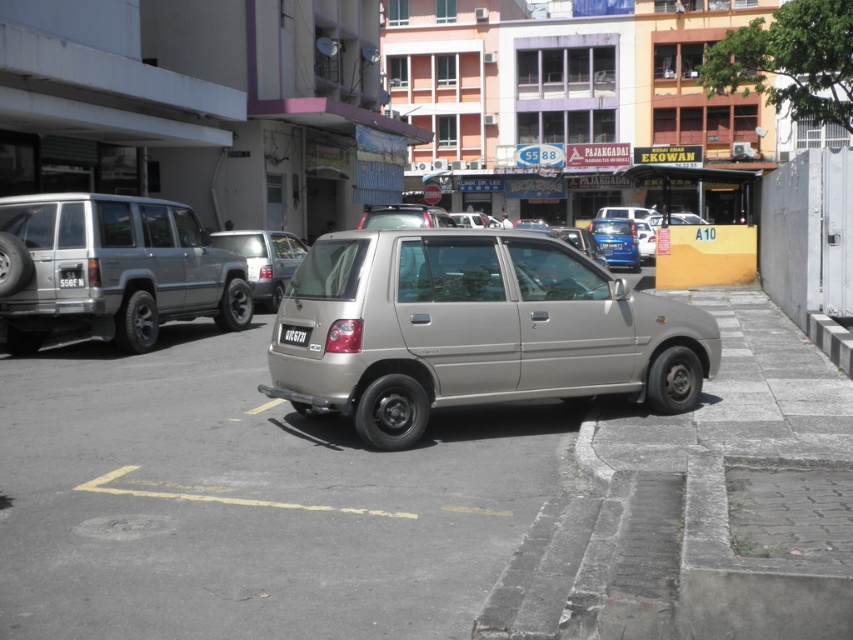
You are a parking attendant checking if the satin silver suv at center fits within the parking space. Considering the size of the black plastic license plate at center, can you determine if the vehicle is too large for the space?

The satin silver suv at center is larger than the black plastic license plate at center. However, the license plate size doesn not determine the parking space size. Therefore, the vehicle size cannot be accurately assessed based on the license plate dimensions alone.

You are a delivery driver who needs to park your vehicle in a narrow alley. You have two options in the parking area shown in the image. Which vehicle between the satin silver minivan at left and the satin silver suv at center has a wider body to consider for space requirements?

The satin silver minivan at left has a wider body than the satin silver suv at center, so it requires more space for parking in a narrow alley.